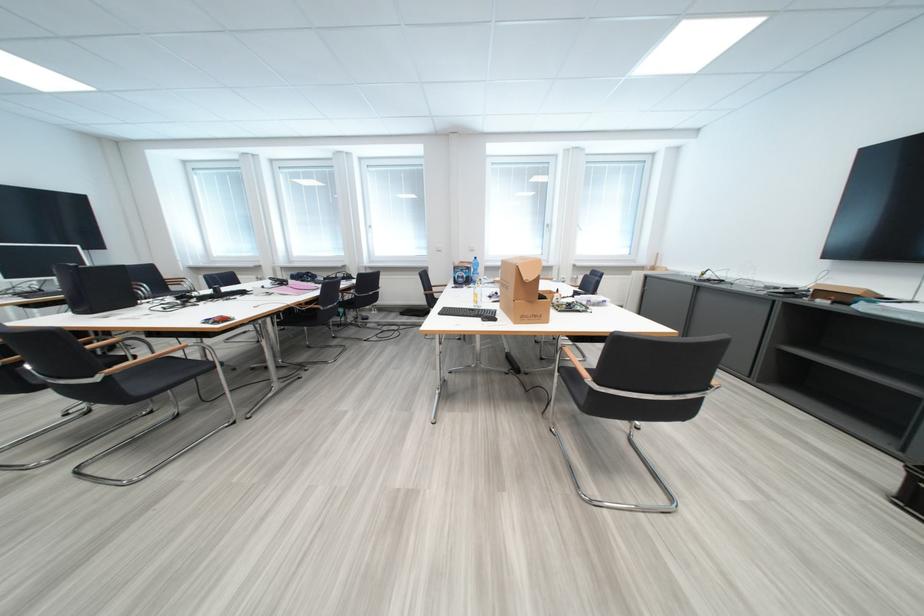
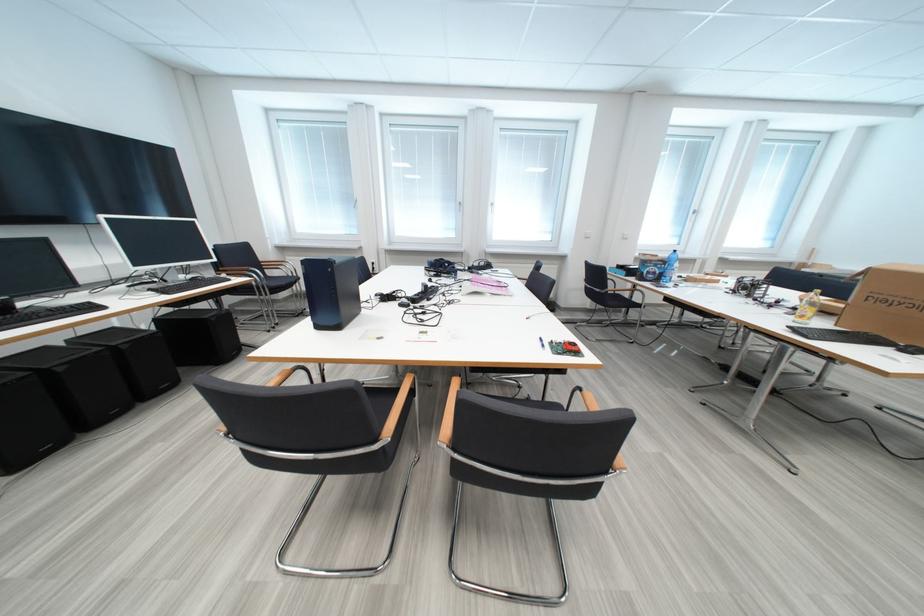
The point at (x=479, y=270) is marked in the first image. Where is the corresponding point in the second image?

(675, 265)